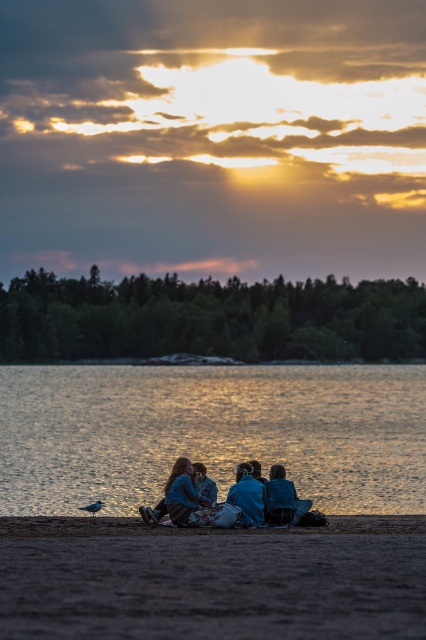
Can you confirm if brown sandy beach at lower center is shorter than blue fabric people at center?

In fact, brown sandy beach at lower center may be taller than blue fabric people at center.

Can you confirm if brown sandy beach at lower center is smaller than blue fabric people at center?

No, brown sandy beach at lower center is not smaller than blue fabric people at center.

Who is more distant from viewer, (218,608) or (141,509)?

Point (141,509)

Identify the location of brown sandy beach at lower center. The height and width of the screenshot is (640, 426). (212, 580).

This screenshot has width=426, height=640. What do you see at coordinates (210, 433) in the screenshot?
I see `glistening water at lower center` at bounding box center [210, 433].

Does glistening water at lower center have a lesser width compared to brown sandy beach at lower center?

In fact, glistening water at lower center might be wider than brown sandy beach at lower center.

Does point (69, 490) come in front of point (393, 618)?

No, (69, 490) is further to viewer.

The width and height of the screenshot is (426, 640). Identify the location of glistening water at lower center. (210, 433).

Between glistening water at lower center and blue fabric people at center, which one is positioned higher?

Positioned higher is glistening water at lower center.

Does point (319, 490) come behind point (152, 518)?

Yes, it is.

Is point (386, 412) closer to camera compared to point (290, 508)?

No, it is not.

What are the coordinates of `glistening water at lower center` in the screenshot? It's located at (210, 433).